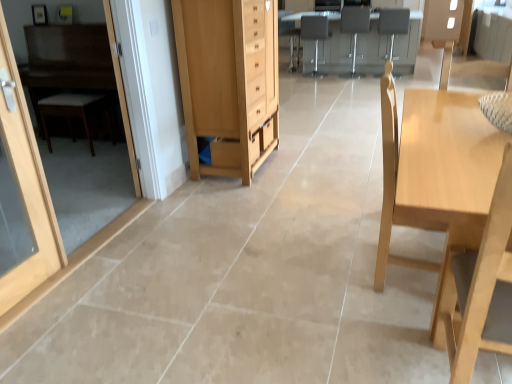
Question: Is white woven stool at left wider than light wood cabinet at center?

Choices:
 (A) no
 (B) yes

Answer: (A)

Question: Does white woven stool at left appear on the right side of light wood cabinet at center?

Choices:
 (A) yes
 (B) no

Answer: (B)

Question: Could you tell me if white woven stool at left is turned towards light wood cabinet at center?

Choices:
 (A) no
 (B) yes

Answer: (A)

Question: Is the depth of white woven stool at left less than that of light wood cabinet at center?

Choices:
 (A) no
 (B) yes

Answer: (A)

Question: Would you say white woven stool at left contains light wood cabinet at center?

Choices:
 (A) no
 (B) yes

Answer: (A)

Question: Does white woven stool at left have a smaller size compared to light wood cabinet at center?

Choices:
 (A) yes
 (B) no

Answer: (A)

Question: From the image's perspective, is matte gray table at center, the 1th table positioned from the back, under light wood chair at right?

Choices:
 (A) yes
 (B) no

Answer: (B)

Question: From a real-world perspective, does matte gray table at center, acting as the second table starting from the bottom, stand above light wood chair at right?

Choices:
 (A) yes
 (B) no

Answer: (B)

Question: Can you confirm if matte gray table at center, the 1th table in the top-to-bottom sequence, is thinner than light wood chair at right?

Choices:
 (A) yes
 (B) no

Answer: (B)

Question: Considering the relative sizes of matte gray table at center, the 1th table in the top-to-bottom sequence, and light wood chair at right in the image provided, is matte gray table at center, the 1th table in the top-to-bottom sequence, bigger than light wood chair at right?

Choices:
 (A) no
 (B) yes

Answer: (B)

Question: Is matte gray table at center, acting as the second table starting from the bottom, taller than light wood chair at right?

Choices:
 (A) yes
 (B) no

Answer: (B)

Question: Considering the relative sizes of matte gray table at center, the 1th table positioned from the back, and light wood chair at right in the image provided, is matte gray table at center, the 1th table positioned from the back, smaller than light wood chair at right?

Choices:
 (A) yes
 (B) no

Answer: (B)

Question: Is light wood chair at right touching matte gray armchair at center, the 3th armchair in the right-to-left sequence?

Choices:
 (A) no
 (B) yes

Answer: (A)